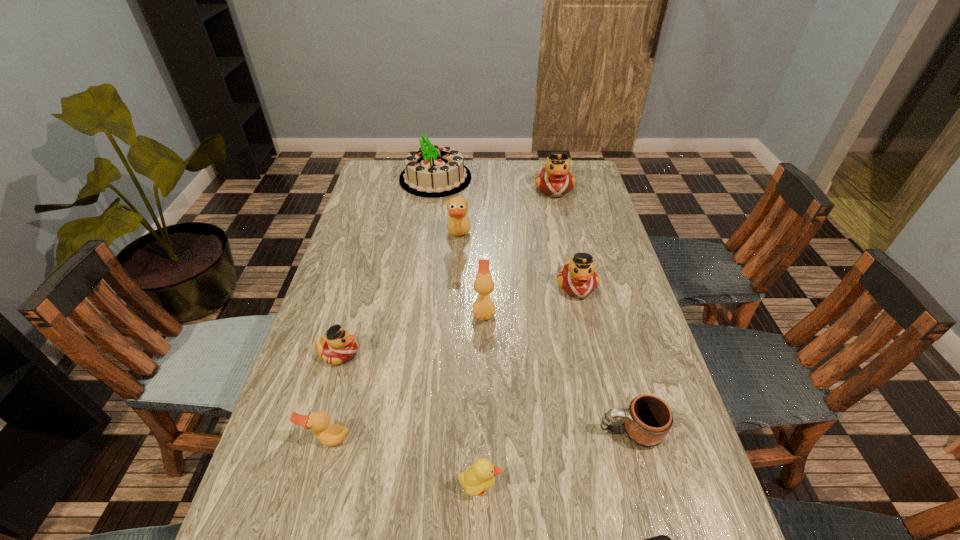
Locate which tan duck ranks second in proximity to the yellow duckling. Please provide its 2D coordinates. Your answer should be formatted as a tuple, i.e. [(x, y)], where the tuple contains the x and y coordinates of a point satisfying the conditions above.

[(483, 308)]

Locate which tan duck is the closest to the nearest object. Please provide its 2D coordinates. Your answer should be formatted as a tuple, i.e. [(x, y)], where the tuple contains the x and y coordinates of a point satisfying the conditions above.

[(329, 435)]

You are a GUI agent. You are given a task and a screenshot of the screen. Output one action in this format:
    pyautogui.click(x=<x>, y=<y>)
    Task: Click on the free space that satisfies the following two spatial constraints: 1. on the beak of the biggest tan duck; 2. on the beak of the leftmost tan duck
    The width and height of the screenshot is (960, 540).
    Given the screenshot: What is the action you would take?
    pyautogui.click(x=447, y=439)